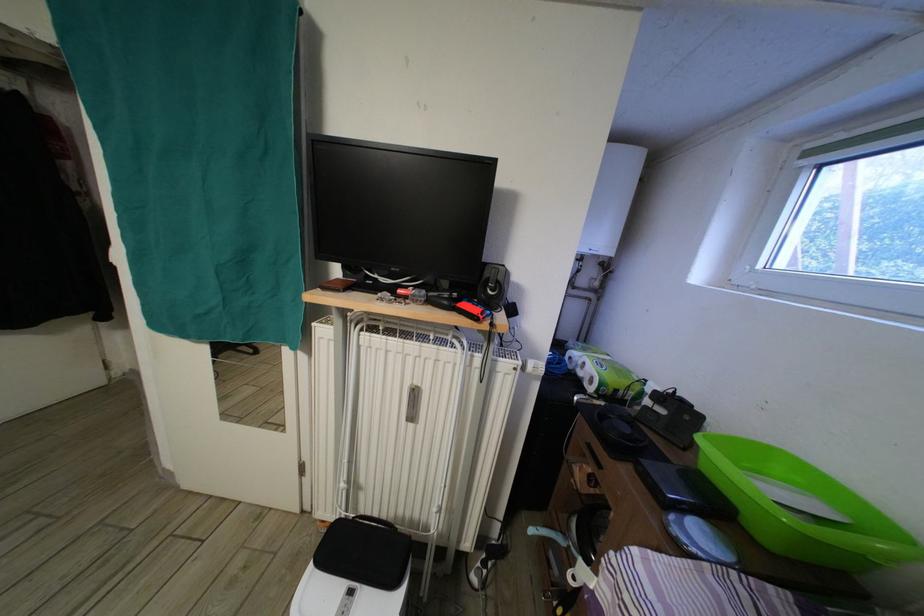
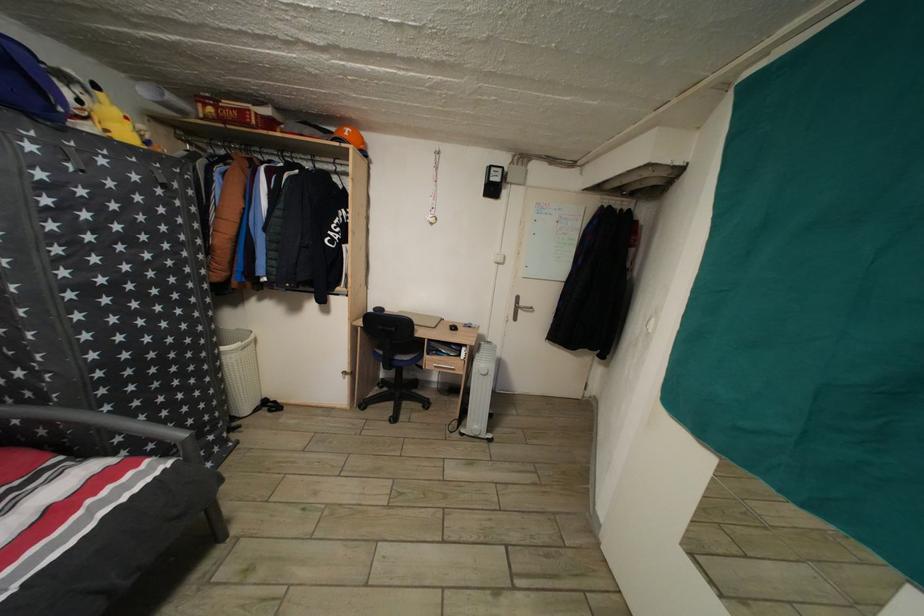
Question: The images are taken continuously from a first-person perspective. In which direction is your viewpoint rotating?

Choices:
 (A) Left
 (B) Right
 (C) Up
 (D) Down

Answer: (A)